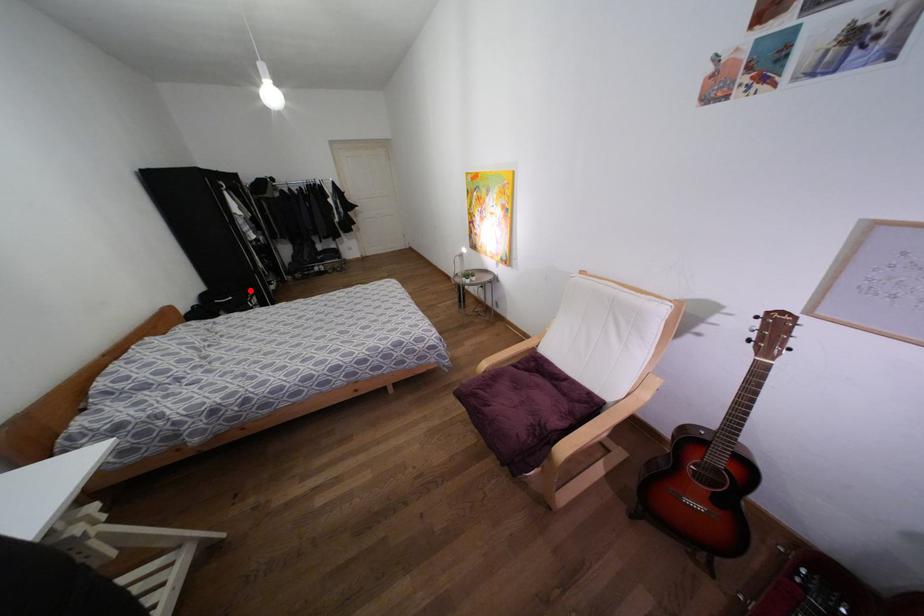
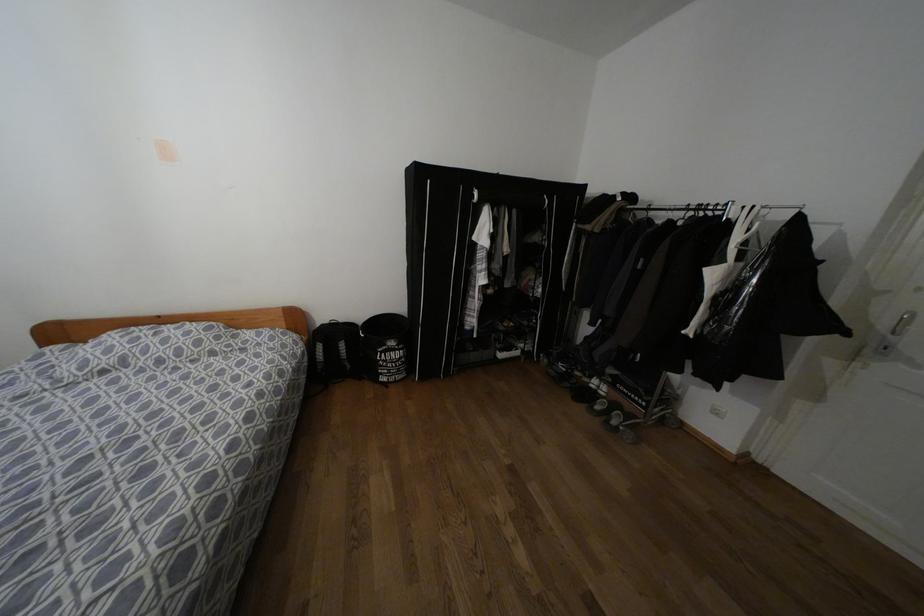
Find the pixel in the second image that matches the highlighted location in the first image.

(391, 342)